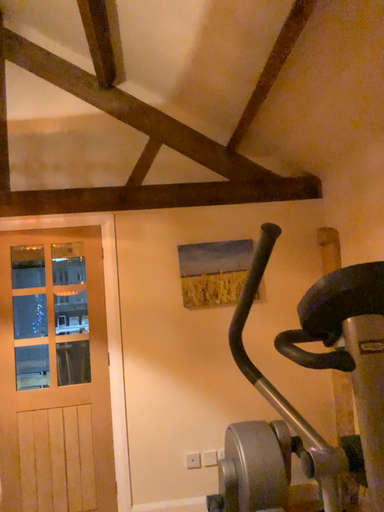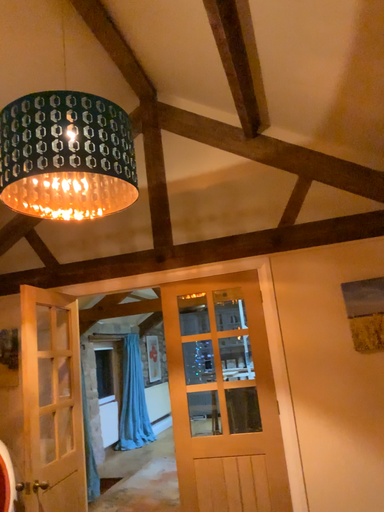
Question: Which way did the camera rotate in the video?

Choices:
 (A) rotated right
 (B) rotated left

Answer: (B)